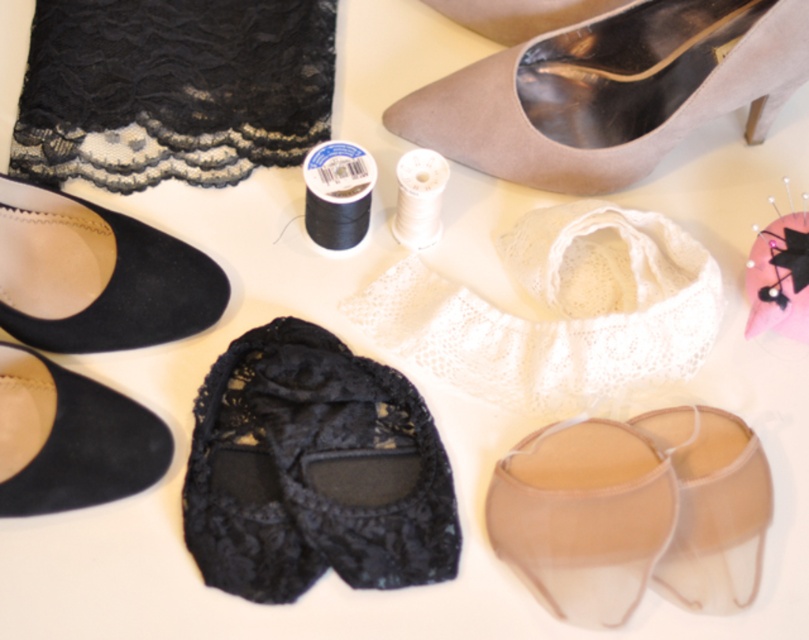
Can you confirm if black lace slipper at center is positioned to the left of suede black shoe at lower left?

In fact, black lace slipper at center is to the right of suede black shoe at lower left.

Is black lace slipper at center smaller than suede black shoe at lower left?

No, black lace slipper at center is not smaller than suede black shoe at lower left.

Between point (282, 346) and point (130, 404), which one is positioned in front?

Point (130, 404)

Locate an element on the screen. The image size is (809, 640). black lace slipper at center is located at coordinates [x=314, y=470].

Can you confirm if suede beige high-heeled shoe at upper center is thinner than suede black shoe at lower left?

No, suede beige high-heeled shoe at upper center is not thinner than suede black shoe at lower left.

Which is in front, point (646, 67) or point (71, 372)?

Point (71, 372)

Locate an element on the screen. This screenshot has width=809, height=640. suede beige high-heeled shoe at upper center is located at coordinates (610, 92).

Can you confirm if black lace slipper at center is positioned above translucent beige sandal at lower right?

Indeed, black lace slipper at center is positioned over translucent beige sandal at lower right.

Where is `black lace slipper at center`? This screenshot has width=809, height=640. black lace slipper at center is located at coordinates (314, 470).